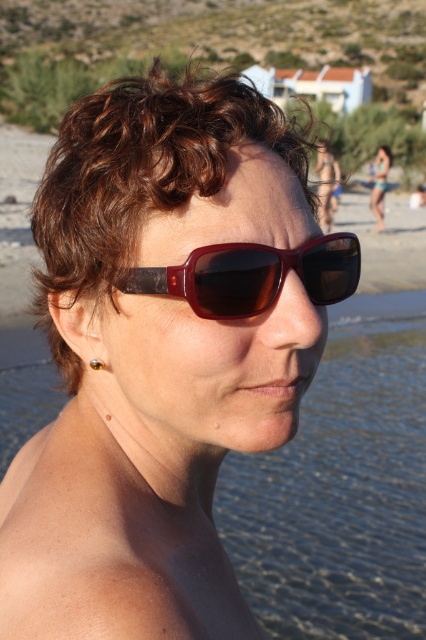
You are a photographer taking a portrait of the person in the scene. You want to highlight the contrast between the clear water at shoulder and the dry skin at lower left. Which side of the person should you focus on to emphasize this contrast?

The clear water at shoulder is positioned on the right side of dry skin at lower left, so focusing on the right side of the person will emphasize the contrast between the two elements.

You are a photographer trying to capture a close detail shot of the shiny brown plastic goggles at center and the matte brown sunglasses at center. Which object should you focus on if you want to capture more details due to its size?

The matte brown sunglasses at center is larger than the shiny brown plastic goggles at center, so focusing on the matte brown sunglasses at center would allow capturing more details due to its larger size.

You are a photographer trying to capture the person in the scene. The person wants their clear water at shoulder and shiny brown plastic goggles at center to be visible in the photo. Based on their positions, which object should you ensure is closer to the right edge of the frame?

The clear water at shoulder should be closer to the right edge of the frame because it is positioned on the right side of the shiny brown plastic goggles at center.